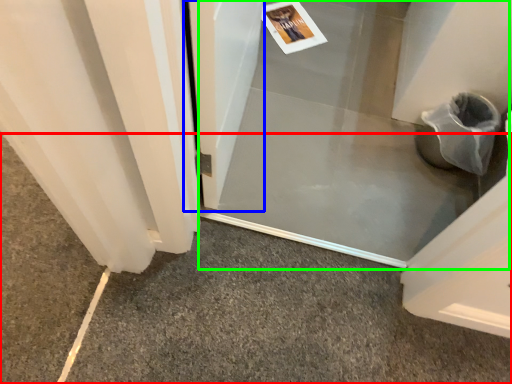
Question: Based on their relative distances, which object is nearer to concrete (highlighted by a red box)? Choose from screen door (highlighted by a blue box) and screen door (highlighted by a green box).

Choices:
 (A) screen door
 (B) screen door

Answer: (B)